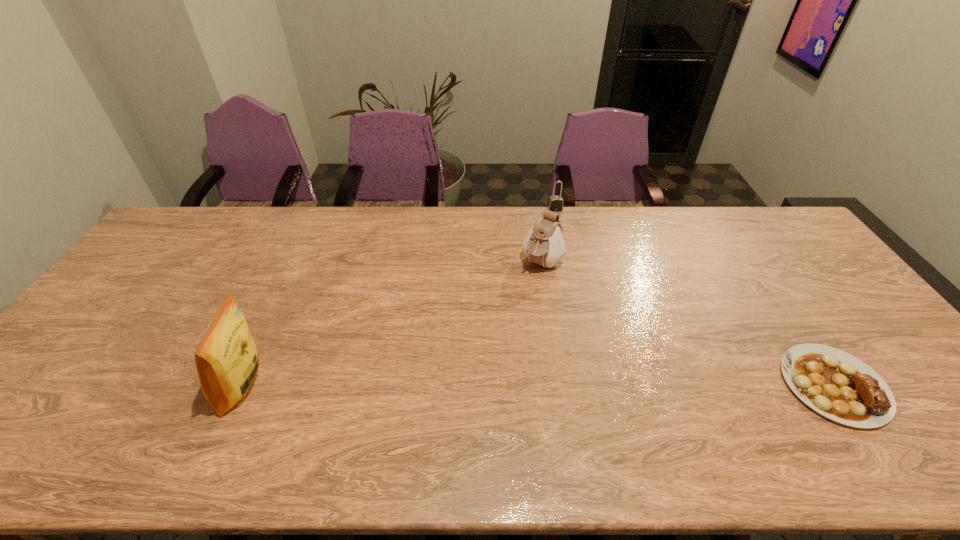
Identify the location of free location located 0.250m on the front-facing side of the tallest object. (119, 386).

Identify the location of vacant region located 0.130m on the back of the rightmost object. (782, 310).

The width and height of the screenshot is (960, 540). I want to click on vacant region located on the front-facing side of the third nearest object, so click(505, 316).

Where is `vacant space located on the front-facing side of the third nearest object`? The width and height of the screenshot is (960, 540). vacant space located on the front-facing side of the third nearest object is located at coordinates (494, 331).

You are a GUI agent. You are given a task and a screenshot of the screen. Output one action in this format:
    pyautogui.click(x=<x>, y=<y>)
    Task: Click on the free region located 0.250m on the front-facing side of the third nearest object
    Image resolution: width=960 pixels, height=540 pixels.
    Given the screenshot: What is the action you would take?
    pyautogui.click(x=494, y=331)

Where is `vacant space located 0.320m on the shackle of the second shortest object`? vacant space located 0.320m on the shackle of the second shortest object is located at coordinates (576, 270).

The height and width of the screenshot is (540, 960). What are the coordinates of `free region located on the shackle of the second shortest object` in the screenshot? It's located at (575, 266).

I want to click on free location located on the shackle of the second shortest object, so click(563, 230).

You are a GUI agent. You are given a task and a screenshot of the screen. Output one action in this format:
    pyautogui.click(x=<x>, y=<y>)
    Task: Click on the object present at the far edge
    
    Given the screenshot: What is the action you would take?
    pyautogui.click(x=555, y=203)

You are a GUI agent. You are given a task and a screenshot of the screen. Output one action in this format:
    pyautogui.click(x=<x>, y=<y>)
    Task: Click on the crisp (potato chip) present at the near edge
    This screenshot has height=540, width=960.
    Given the screenshot: What is the action you would take?
    pyautogui.click(x=227, y=360)